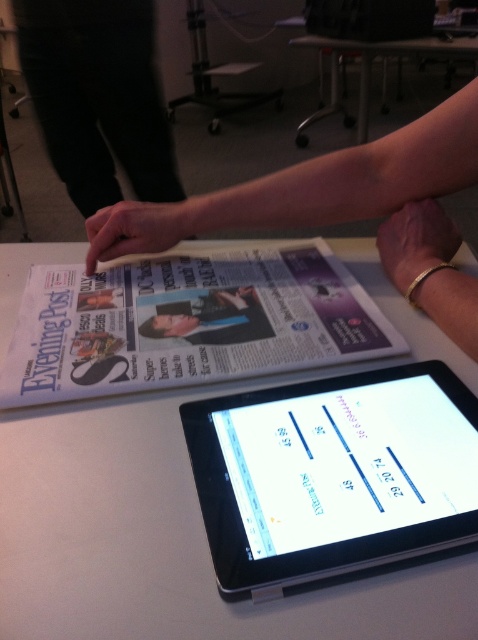
You are a delivery robot with a 12 inch arm. You need to reach a package placed at point (335, 490). Can your arm reach it?

The distance between point (335, 490) and the camera is 14.81 inches. Since your arm is only 12 inches long, you cannot reach the package placed at point (335, 490).

You are a photographer setting up a shot of the white glossy table at center and the matte black finger at upper center. To ensure both objects are in focus, which one should you adjust the camera focus on first?

The white glossy table at center is closer to the viewer than the matte black finger at upper center. To ensure both are in focus, adjust the focus starting from the closer object, which is the white glossy table at center, then the matte black finger at upper center.

You are organizing a display table and need to arrange the white glossy newspaper at upper center and the black fabric pants at upper left. Which object requires more horizontal space on the table?

The black fabric pants at upper left requires more horizontal space on the table because its width is greater than the white glossy newspaper at upper center.